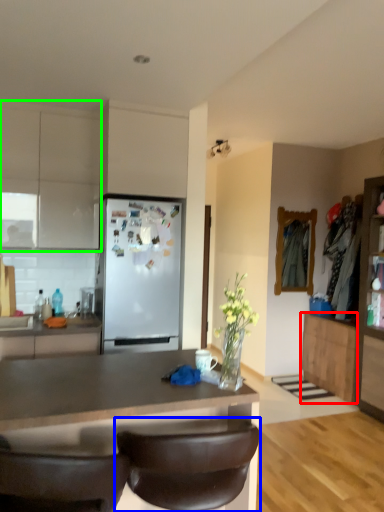
Question: Based on their relative distances, which object is nearer to cabinetry (highlighted by a red box)? Choose from chair (highlighted by a blue box) and cabinetry (highlighted by a green box).

Choices:
 (A) chair
 (B) cabinetry

Answer: (A)